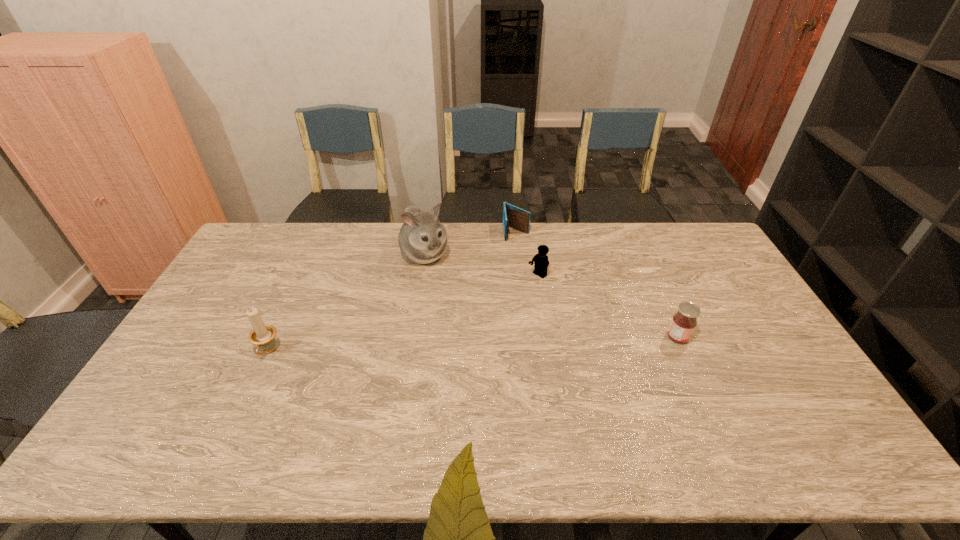
This screenshot has width=960, height=540. What are the coordinates of `vacant spot on the desktop that is between the candle_holder and the rightmost object and is positioned on the front-facing side of the Lego` in the screenshot? It's located at (445, 346).

Locate an element on the screen. The width and height of the screenshot is (960, 540). vacant spot on the desktop that is between the second tallest object and the jam and is positioned on the face of the tallest object is located at coordinates (493, 344).

The image size is (960, 540). In order to click on vacant space on the desktop that is between the leftmost object and the jam and is positioned on the exterior surface of the wallet in this screenshot , I will do `click(533, 343)`.